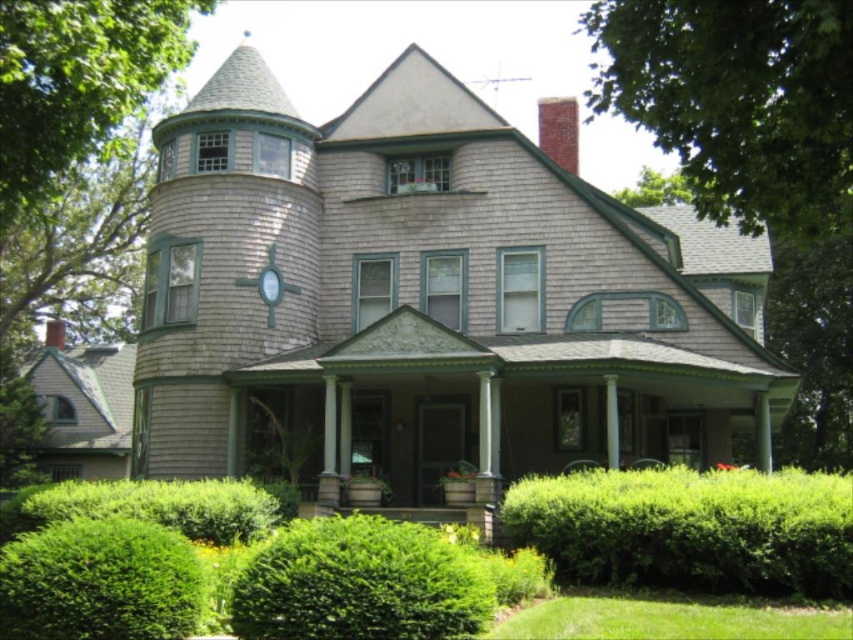
You are standing in front of the house and want to walk from the green leafy hedge at lower left to the green grass at lower right. Which direction should you move relative to the house?

You should move to the right relative to the house because the green leafy hedge at lower left is positioned to the left of the green grass at lower right.

You are standing in front of the house and want to walk from the green leafy hedge at lower left to the green grass at lower right. Which direction should you move to go from the hedge to the grass?

You should move to the right to go from the green leafy hedge at lower left to the green grass at lower right since the hedge is located at the lower left and the grass is at the lower right of the scene.